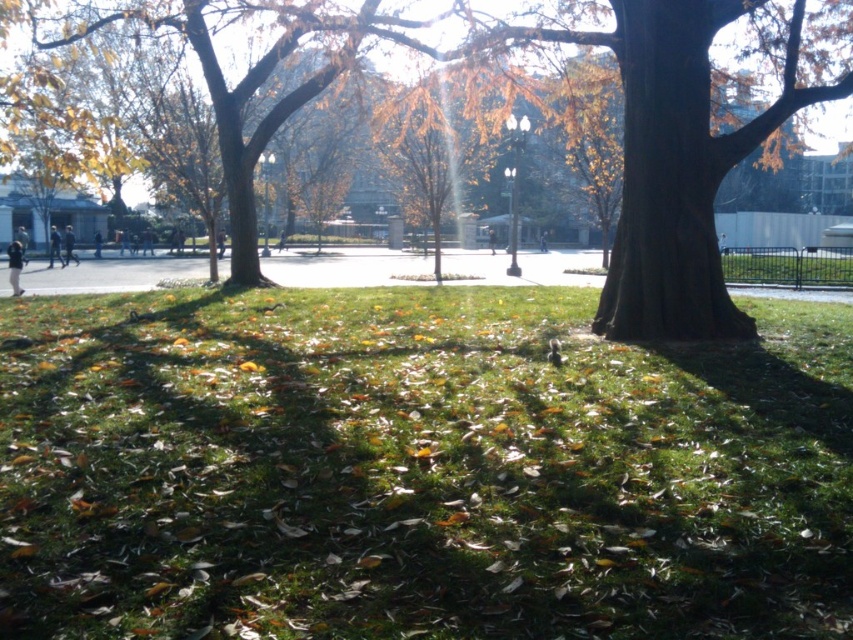
You are standing at the center of the park and see the point at coordinates (22, 237). What object is located at that point?

The point at coordinates (22, 237) corresponds to the light blue jeans at lower left.

You are a photographer planning to capture a photo of the two people wearing light blue jeans at lower left and dark blue jeans at center in the park scene. Considering their jean widths, which person would you position closer to the camera to ensure their legs appear proportionate in the final image?

Since the light blue jeans at lower left are wider than the dark blue jeans at center, positioning the person in the light blue jeans at lower left closer to the camera would help maintain proportional leg appearance in the photo.